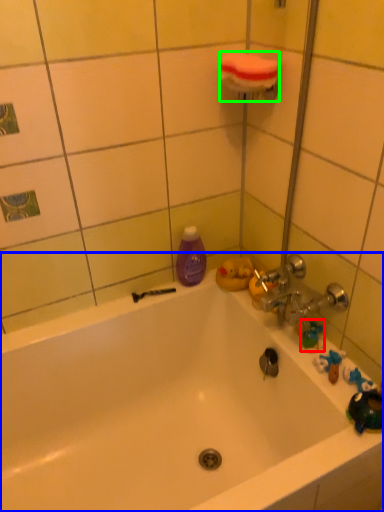
Question: Considering the real-world distances, which object is closest to toy (highlighted by a red box)? bathtub (highlighted by a blue box) or towel bar (highlighted by a green box).

Choices:
 (A) bathtub
 (B) towel bar

Answer: (A)